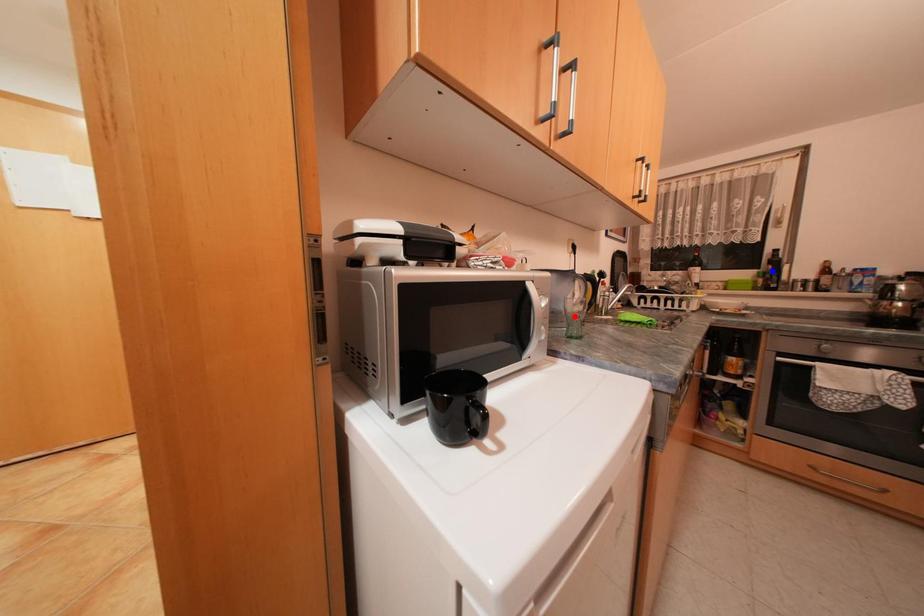
Question: In the image, two points are highlighted. Which point is nearer to the camera? Reply with the corresponding letter.

Choices:
 (A) blue point
 (B) red point

Answer: (B)